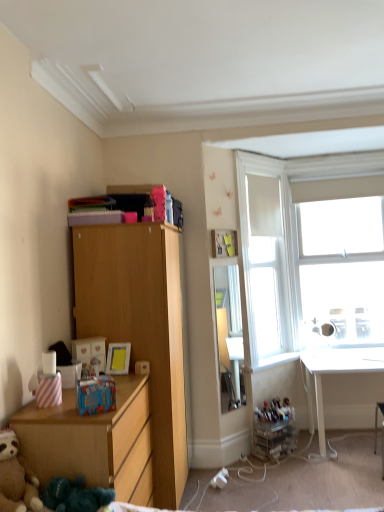
Locate an element on the screen. This screenshot has height=512, width=384. free spot to the left of white plastic power outlet at lower center is located at coordinates point(198,488).